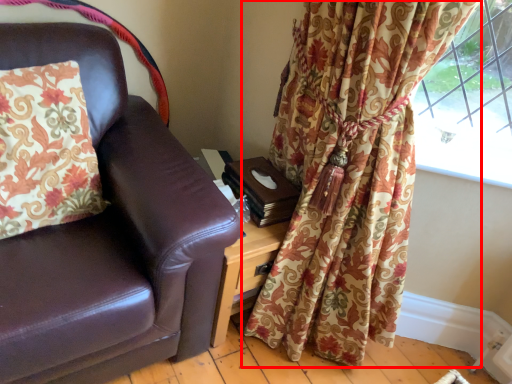
Question: From the image's perspective, where is curtain (annotated by the red box) located in relation to pillow in the image?

Choices:
 (A) above
 (B) below

Answer: (B)